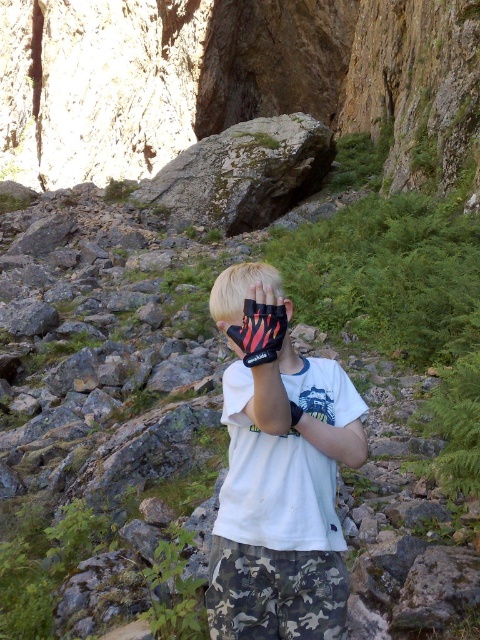
You are a geologist examining the rugged terrain in the image. You notice a point marked at coordinates (242, 173). Based on the scene description, what specific feature does this point likely indicate?

The point at (242, 173) corresponds to the green mossy rock at upper center.

You are an observer looking at the person in the rugged terrain. Which clothing item, the white matte shirt at center or the camo fabric shorts at lower center, has a greater width?

The white matte shirt at center has a greater width than the camo fabric shorts at lower center according to the description.